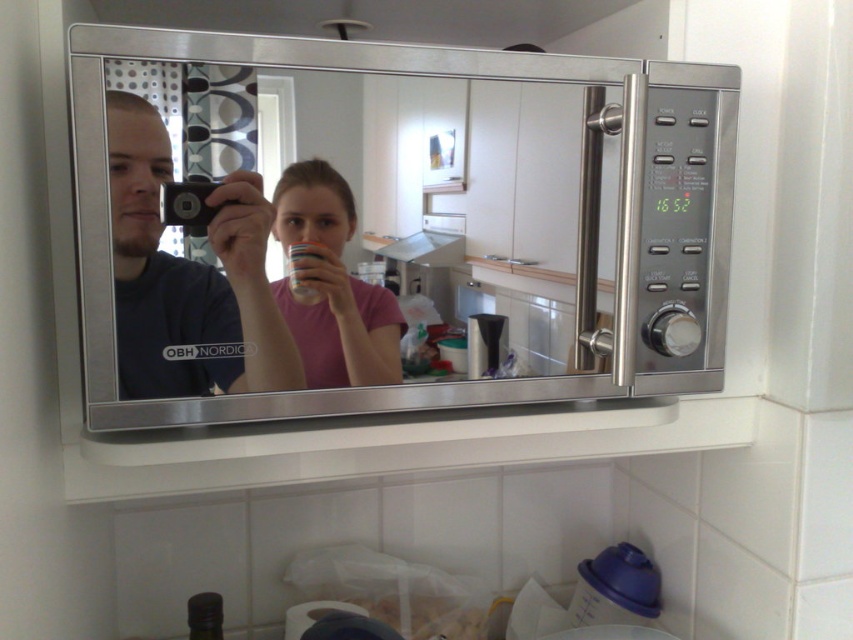
What object is located at the point with coordinates (384, 209) in the kitchen scene?

The point at coordinates (384, 209) corresponds to the stainless steel microwave at upper center.

You are standing in the kitchen and want to place a small plant between the two points, point [335,276] and point [345,232]. Which point should the plant be closer to so it appears closer to you?

The plant should be placed closer to point [335,276] because it is further to the viewer than point [345,232].

You are a delivery person who needs to place a package on the kitchen counter. The package is 0.3 meters wide. The counter is 1.2 meters wide. The stainless steel microwave at upper center is in the way. Can you place the package on the counter without moving the microwave?

The stainless steel microwave at upper center is located at point (384, 209). Since the counter is 1.2 meters wide and the package is only 0.3 meters wide, there should be enough space on either side of the microwave to place the package without moving it.